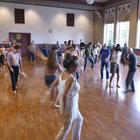
Image resolution: width=140 pixels, height=140 pixels. I want to click on floor, so click(x=34, y=110).